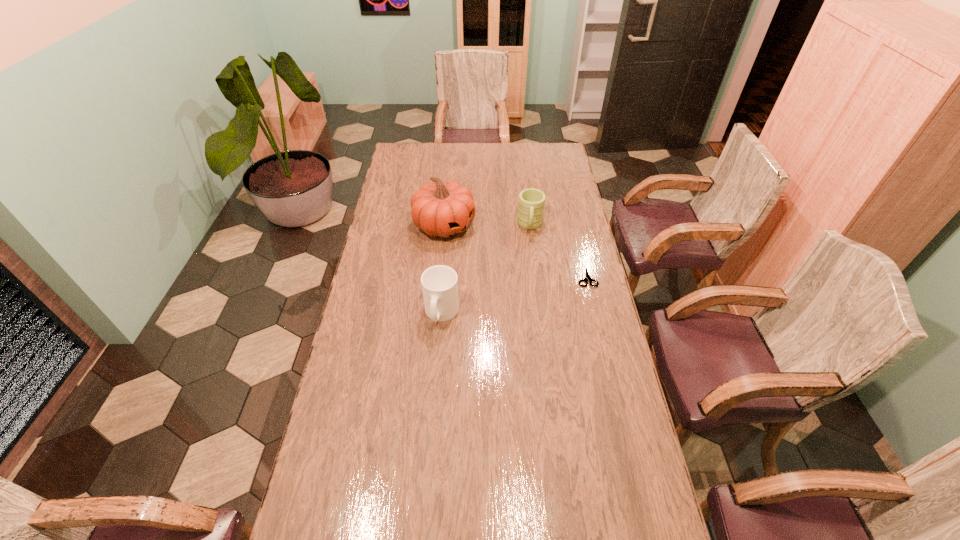
What are the coordinates of `free location that satisfies the following two spatial constraints: 1. on the front side of the second nearest object; 2. on the right side of the pumpkin` in the screenshot? It's located at (440, 277).

You are a GUI agent. You are given a task and a screenshot of the screen. Output one action in this format:
    pyautogui.click(x=<x>, y=<y>)
    Task: Click on the free spot that satisfies the following two spatial constraints: 1. on the front side of the pumpkin; 2. on the left side of the third farthest object
    This screenshot has width=960, height=540.
    Given the screenshot: What is the action you would take?
    click(440, 277)